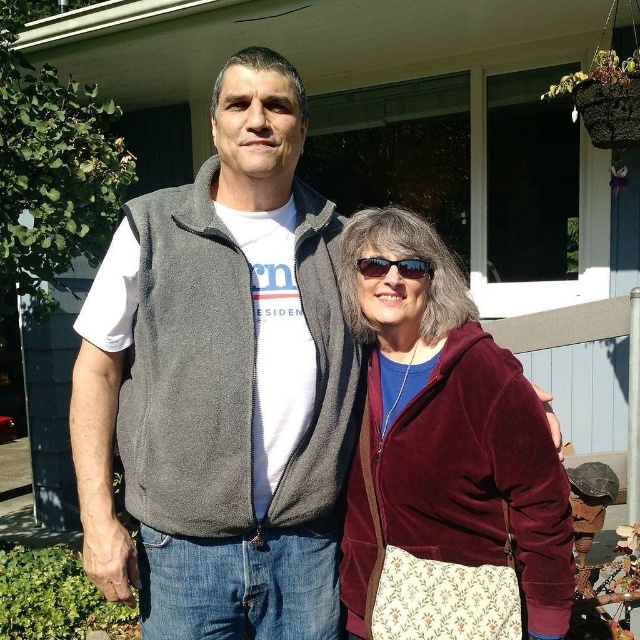
Consider the image. Does velvet maroon jacket at center have a greater height compared to matte black sunglasses at center?

Yes.

I want to click on velvet maroon jacket at center, so click(452, 420).

This screenshot has width=640, height=640. I want to click on velvet maroon jacket at center, so click(452, 420).

In the scene shown: Which is more to the left, gray fleece vest at center or matte black sunglasses at center?

Positioned to the left is gray fleece vest at center.

Who is more distant from viewer, (259, 177) or (422, 273)?

Positioned behind is point (259, 177).

The height and width of the screenshot is (640, 640). What are the coordinates of `gray fleece vest at center` in the screenshot? It's located at (220, 385).

Can you confirm if gray fleece vest at center is shorter than velvet maroon jacket at center?

Incorrect, gray fleece vest at center's height does not fall short of velvet maroon jacket at center's.

Between gray fleece vest at center and velvet maroon jacket at center, which one is positioned higher?

gray fleece vest at center is higher up.

Is point (250, 88) behind point (545, 611)?

Yes, it is.

Where is `gray fleece vest at center`? This screenshot has height=640, width=640. gray fleece vest at center is located at coordinates (220, 385).